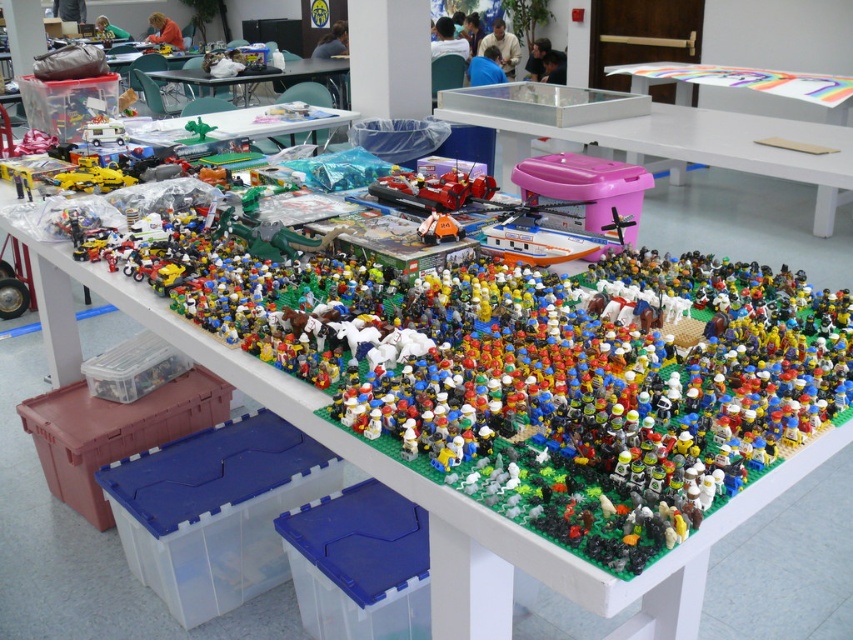
Question: Can you confirm if pink plastic bin at center is bigger than matte plastic table at upper center?

Choices:
 (A) no
 (B) yes

Answer: (B)

Question: Is pink plastic bin at center below green plastic table at upper center?

Choices:
 (A) no
 (B) yes

Answer: (B)

Question: Among these objects, which one is farthest from the camera?

Choices:
 (A) green plastic table at upper center
 (B) pink plastic bin at center
 (C) matte plastic table at upper center

Answer: (C)

Question: Which object appears farthest from the camera in this image?

Choices:
 (A) pink plastic bin at center
 (B) green plastic table at upper center
 (C) matte plastic table at upper center

Answer: (C)

Question: Considering the real-world distances, which object is farthest from the matte plastic table at upper center?

Choices:
 (A) green plastic table at upper center
 (B) pink plastic bin at center

Answer: (B)

Question: Is pink plastic bin at center smaller than green plastic table at upper center?

Choices:
 (A) yes
 (B) no

Answer: (B)